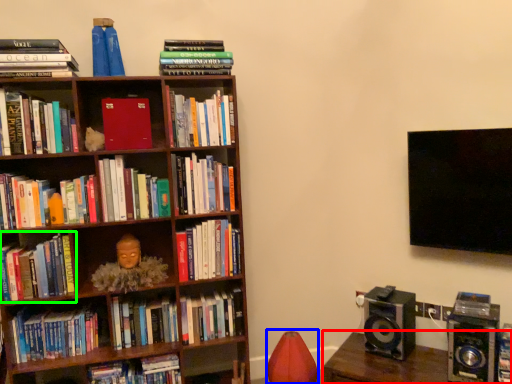
Question: Considering the real-world distances, which object is closest to furniture (highlighted by a red box)? bean bag chair (highlighted by a blue box) or book (highlighted by a green box).

Choices:
 (A) bean bag chair
 (B) book

Answer: (A)